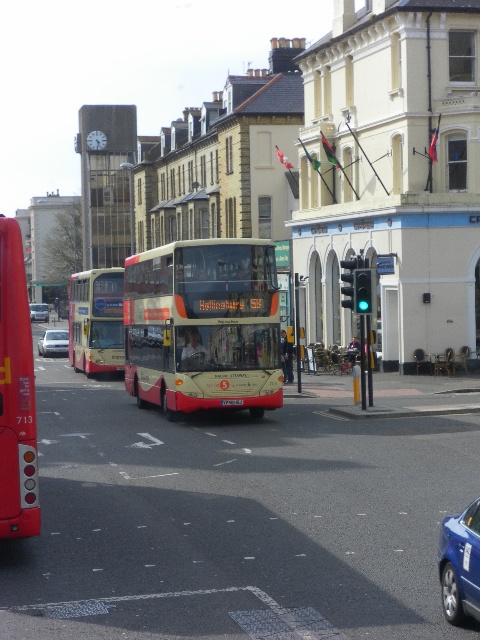
Question: Can you confirm if matte red bus at left is smaller than metallic blue sedan at lower right?

Choices:
 (A) yes
 (B) no

Answer: (B)

Question: Is beige metallic bus at center further to the viewer compared to metallic blue sedan at lower right?

Choices:
 (A) no
 (B) yes

Answer: (B)

Question: Is matte gold bus at center behind silver metallic sedan at center?

Choices:
 (A) yes
 (B) no

Answer: (B)

Question: Considering the real-world distances, which object is farthest from the silver metallic sedan at center?

Choices:
 (A) beige metallic bus at center
 (B) silver metallic car at center
 (C) red plastic license plate at center

Answer: (B)

Question: Estimate the real-world distances between objects in this image. Which object is closer to the red plastic license plate at center?

Choices:
 (A) metallic blue sedan at lower right
 (B) matte gold bus at center

Answer: (A)

Question: Which object is the farthest from the silver metallic car at center?

Choices:
 (A) red plastic license plate at center
 (B) beige metallic bus at center
 (C) matte red bus at left

Answer: (C)